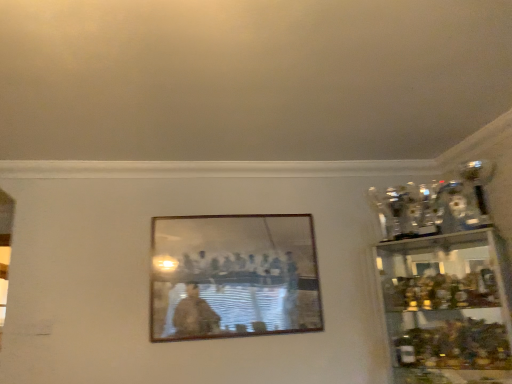
Question: Can you confirm if clear glass cabinet at right is taller than wooden picture frame at center?

Choices:
 (A) yes
 (B) no

Answer: (A)

Question: From a real-world perspective, is clear glass cabinet at right below wooden picture frame at center?

Choices:
 (A) yes
 (B) no

Answer: (A)

Question: Can wooden picture frame at center be found inside clear glass cabinet at right?

Choices:
 (A) no
 (B) yes

Answer: (A)

Question: Is clear glass cabinet at right wider than wooden picture frame at center?

Choices:
 (A) no
 (B) yes

Answer: (B)

Question: Is clear glass cabinet at right not near wooden picture frame at center?

Choices:
 (A) no
 (B) yes

Answer: (A)

Question: Considering the relative positions of clear glass cabinet at right and wooden picture frame at center in the image provided, is clear glass cabinet at right to the right of wooden picture frame at center from the viewer's perspective?

Choices:
 (A) yes
 (B) no

Answer: (A)

Question: Can you confirm if wooden picture frame at center is wider than clear glass cabinet at right?

Choices:
 (A) no
 (B) yes

Answer: (A)

Question: Is wooden picture frame at center in front of clear glass cabinet at right?

Choices:
 (A) no
 (B) yes

Answer: (A)

Question: Is wooden picture frame at center positioned behind clear glass cabinet at right?

Choices:
 (A) no
 (B) yes

Answer: (B)

Question: Is wooden picture frame at center looking in the opposite direction of clear glass cabinet at right?

Choices:
 (A) no
 (B) yes

Answer: (A)

Question: Is wooden picture frame at center surrounding clear glass cabinet at right?

Choices:
 (A) no
 (B) yes

Answer: (A)

Question: Is wooden picture frame at center at the left side of clear glass cabinet at right?

Choices:
 (A) no
 (B) yes

Answer: (B)

Question: Is point (276, 296) closer or farther from the camera than point (448, 377)?

Choices:
 (A) closer
 (B) farther

Answer: (B)